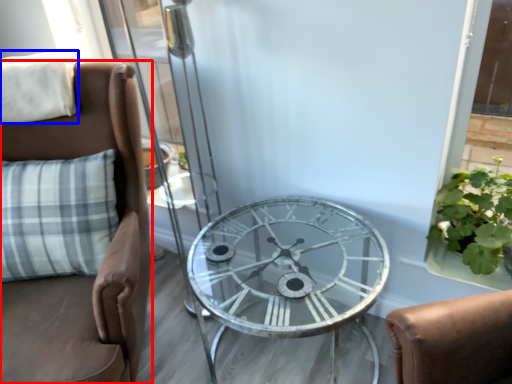
Question: Which object appears farthest to the camera in this image, chair (highlighted by a red box) or pillow (highlighted by a blue box)?

Choices:
 (A) chair
 (B) pillow

Answer: (B)